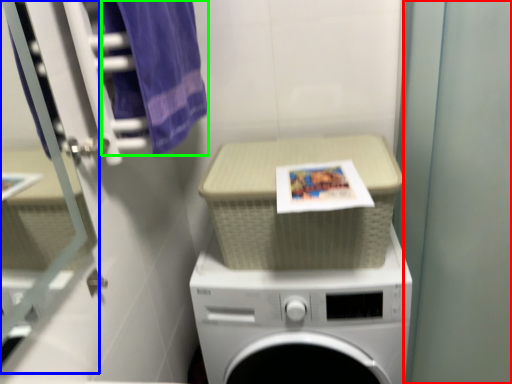
Question: Which object is positioned farthest from screen door (highlighted by a red box)? Select from glass door (highlighted by a blue box) and bath towel (highlighted by a green box).

Choices:
 (A) glass door
 (B) bath towel

Answer: (A)